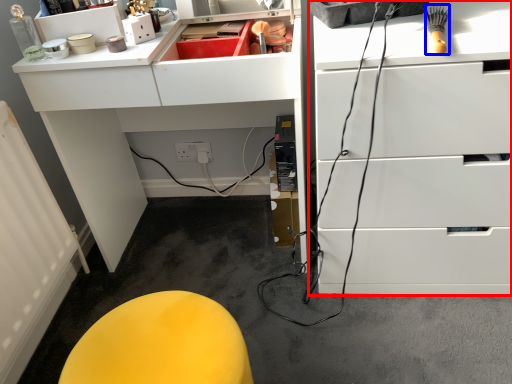
Question: Which object appears farthest to the camera in this image, chest of drawers (highlighted by a red box) or brush (highlighted by a blue box)?

Choices:
 (A) chest of drawers
 (B) brush

Answer: (B)